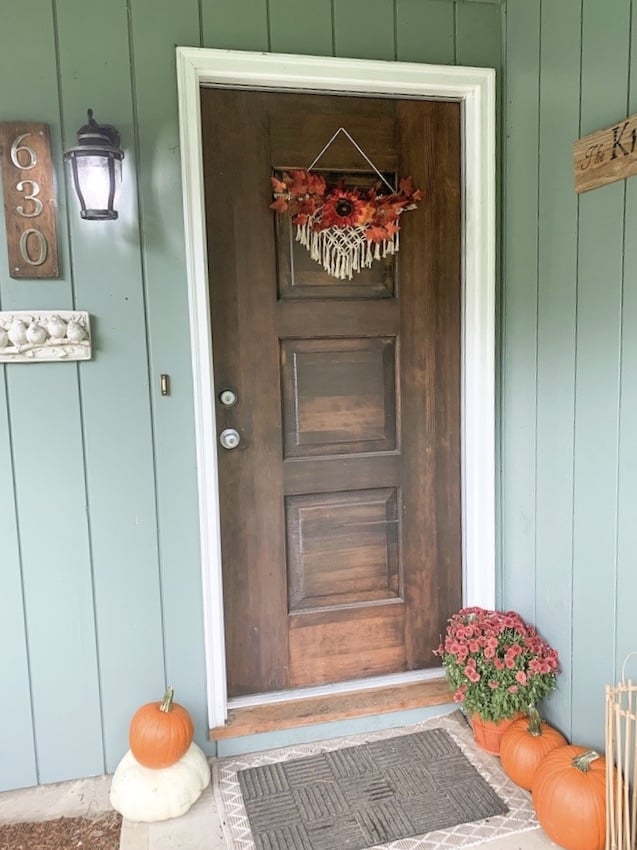
Find any where you wipe your feet in the image. Your answer should be formatted as a list of tuples, i.e. [(x1, y1), (x2, y2), ...], where each tuple contains the x and y coordinates of a point satisfying the conditions above.

[(364, 784)]